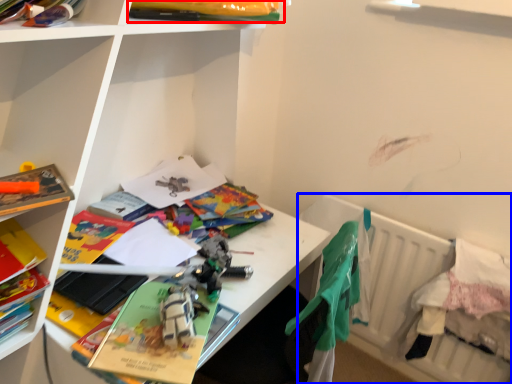
Question: Which point is further to the camera, book (highlighted by a red box) or bed (highlighted by a blue box)?

Choices:
 (A) book
 (B) bed

Answer: (B)